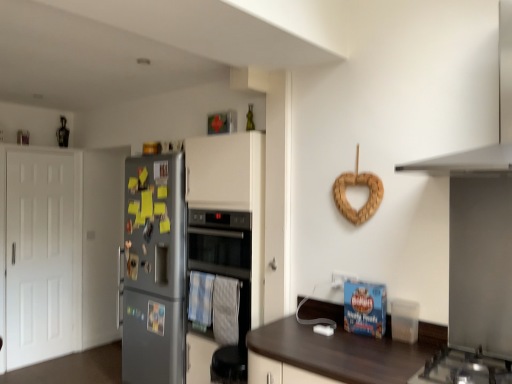
Question: Is white matte door at left far away from satin silver fridge at left?

Choices:
 (A) no
 (B) yes

Answer: (B)

Question: Considering the relative sizes of white matte door at left and satin silver fridge at left in the image provided, is white matte door at left shorter than satin silver fridge at left?

Choices:
 (A) no
 (B) yes

Answer: (A)

Question: Considering the relative sizes of white matte door at left and satin silver fridge at left in the image provided, is white matte door at left bigger than satin silver fridge at left?

Choices:
 (A) yes
 (B) no

Answer: (B)

Question: Can you confirm if white matte door at left is thinner than satin silver fridge at left?

Choices:
 (A) no
 (B) yes

Answer: (B)

Question: Does white matte door at left turn towards satin silver fridge at left?

Choices:
 (A) yes
 (B) no

Answer: (A)

Question: From the image's perspective, does white matte door at left appear lower than satin silver fridge at left?

Choices:
 (A) yes
 (B) no

Answer: (B)

Question: Is white matte door at left in front of white matte exhaust hood at upper right?

Choices:
 (A) no
 (B) yes

Answer: (A)

Question: From a real-world perspective, is white matte door at left physically below white matte exhaust hood at upper right?

Choices:
 (A) no
 (B) yes

Answer: (B)

Question: Can you see white matte door at left touching white matte exhaust hood at upper right?

Choices:
 (A) no
 (B) yes

Answer: (A)

Question: Considering the relative sizes of white matte door at left and white matte exhaust hood at upper right in the image provided, is white matte door at left taller than white matte exhaust hood at upper right?

Choices:
 (A) no
 (B) yes

Answer: (B)

Question: Considering the relative positions of white matte door at left and white matte exhaust hood at upper right in the image provided, is white matte door at left behind white matte exhaust hood at upper right?

Choices:
 (A) yes
 (B) no

Answer: (A)

Question: From the image's perspective, is white matte door at left under white matte exhaust hood at upper right?

Choices:
 (A) no
 (B) yes

Answer: (B)

Question: Is white matte door at left with black glass oven at center?

Choices:
 (A) yes
 (B) no

Answer: (B)